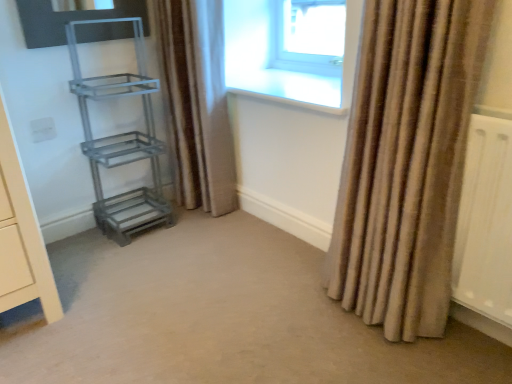
The image size is (512, 384). Find the location of `free space to the right of metallic gray shelf at lower left, which ranks as the second shelf in top-to-bottom order`. free space to the right of metallic gray shelf at lower left, which ranks as the second shelf in top-to-bottom order is located at coordinates (193, 226).